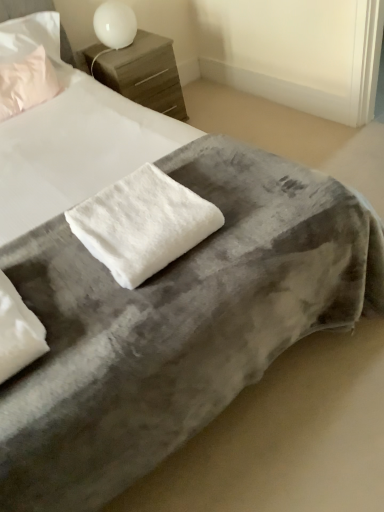
Where is `wooden nightstand at upper center`? Image resolution: width=384 pixels, height=512 pixels. wooden nightstand at upper center is located at coordinates (141, 72).

Describe the element at coordinates (17, 332) in the screenshot. Image resolution: width=384 pixels, height=512 pixels. I see `white fluffy pillow at lower left, which is counted as the 1th pillow, starting from the bottom` at that location.

Measure the distance between white fluffy towel at center and camera.

white fluffy towel at center and camera are 3.60 feet apart from each other.

Describe the element at coordinates (26, 83) in the screenshot. The width and height of the screenshot is (384, 512). I see `matte pink pillow at upper left, the 2th pillow from the front` at that location.

Describe the element at coordinates (115, 24) in the screenshot. I see `white glossy table lamp at upper center` at that location.

You are a GUI agent. You are given a task and a screenshot of the screen. Output one action in this format:
    pyautogui.click(x=<x>, y=<y>)
    Task: Click on the wooden nightstand at upper center
    This screenshot has height=512, width=384.
    Given the screenshot: What is the action you would take?
    pyautogui.click(x=141, y=72)

Does point (145, 98) come in front of point (96, 9)?

No, it is not.

Does wooden nightstand at upper center have a lesser width compared to white glossy table lamp at upper center?

In fact, wooden nightstand at upper center might be wider than white glossy table lamp at upper center.

From the picture: From a real-world perspective, is wooden nightstand at upper center physically below white glossy table lamp at upper center?

Yes, from a real-world perspective, wooden nightstand at upper center is under white glossy table lamp at upper center.

Is wooden nightstand at upper center to the left of white glossy table lamp at upper center from the viewer's perspective?

No.

Is matte pink pillow at upper left, the 2th pillow from the front, located outside white fluffy pillow at lower left, the 1th pillow when ordered from front to back?

Result: matte pink pillow at upper left, the 2th pillow from the front, lies outside white fluffy pillow at lower left, the 1th pillow when ordered from front to back,'s area.

From a real-world perspective, who is located lower, matte pink pillow at upper left, which is the 1th pillow in top-to-bottom order, or white fluffy pillow at lower left, the second pillow in the top-to-bottom sequence?

white fluffy pillow at lower left, the second pillow in the top-to-bottom sequence.

Which is more to the right, matte pink pillow at upper left, which is the 1th pillow in top-to-bottom order, or white fluffy pillow at lower left, the 1th pillow when ordered from front to back?

→ white fluffy pillow at lower left, the 1th pillow when ordered from front to back, is more to the right.

Which object is further away from the camera taking this photo, matte pink pillow at upper left, positioned as the second pillow in right-to-left order, or white fluffy pillow at lower left, the first pillow in the right-to-left sequence?

matte pink pillow at upper left, positioned as the second pillow in right-to-left order, is further from the camera.

Considering the relative positions of white glossy table lamp at upper center and wooden nightstand at upper center in the image provided, is white glossy table lamp at upper center in front of wooden nightstand at upper center?

Yes, white glossy table lamp at upper center is in front of wooden nightstand at upper center.

Is point (115, 22) closer or farther from the camera than point (153, 106)?

Clearly, point (115, 22) is closer to the camera than point (153, 106).

Is white glossy table lamp at upper center bigger or smaller than wooden nightstand at upper center?

Considering their sizes, white glossy table lamp at upper center takes up less space than wooden nightstand at upper center.

From a real-world perspective, relative to wooden nightstand at upper center, is white glossy table lamp at upper center vertically above or below?

From a real-world perspective, white glossy table lamp at upper center is physically above wooden nightstand at upper center.

Is white fluffy towel at center not within matte pink pillow at upper left, the 2th pillow from the front?

Yes, white fluffy towel at center is not within matte pink pillow at upper left, the 2th pillow from the front.

Image resolution: width=384 pixels, height=512 pixels. Find the location of `cloth that appears on the right of matte pink pillow at upper left, the first pillow positioned from the left`. cloth that appears on the right of matte pink pillow at upper left, the first pillow positioned from the left is located at coordinates (142, 224).

Is white fluffy towel at center far from matte pink pillow at upper left, marked as the second pillow in a bottom-to-top arrangement?

That's right, there is a large distance between white fluffy towel at center and matte pink pillow at upper left, marked as the second pillow in a bottom-to-top arrangement.

What's the angular difference between white fluffy towel at center and matte pink pillow at upper left, marked as the second pillow in a bottom-to-top arrangement,'s facing directions?

The facing directions of white fluffy towel at center and matte pink pillow at upper left, marked as the second pillow in a bottom-to-top arrangement, are 2.74 degrees apart.

Considering the sizes of objects white fluffy pillow at lower left, the second pillow in the top-to-bottom sequence, and white fluffy towel at center in the image provided, who is shorter, white fluffy pillow at lower left, the second pillow in the top-to-bottom sequence, or white fluffy towel at center?

Standing shorter between the two is white fluffy towel at center.

Which object is wider, white fluffy pillow at lower left, the first pillow in the right-to-left sequence, or white fluffy towel at center?

white fluffy pillow at lower left, the first pillow in the right-to-left sequence.

Which is closer, (19, 331) or (216, 226)?

Point (19, 331) is closer to the camera than point (216, 226).

Looking at this image, is matte pink pillow at upper left, which is the 1th pillow in top-to-bottom order, taller or shorter than wooden nightstand at upper center?

In the image, matte pink pillow at upper left, which is the 1th pillow in top-to-bottom order, appears to be shorter than wooden nightstand at upper center.

How many degrees apart are the facing directions of matte pink pillow at upper left, positioned as the second pillow in right-to-left order, and wooden nightstand at upper center?

The facing directions of matte pink pillow at upper left, positioned as the second pillow in right-to-left order, and wooden nightstand at upper center are 3.21 degrees apart.

Is matte pink pillow at upper left, the first pillow positioned from the left, wider or thinner than wooden nightstand at upper center?

Considering their sizes, matte pink pillow at upper left, the first pillow positioned from the left, looks slimmer than wooden nightstand at upper center.

Which of these two, wooden nightstand at upper center or matte pink pillow at upper left, the 2th pillow from the front, is thinner?

Thinner between the two is matte pink pillow at upper left, the 2th pillow from the front.

Would you consider wooden nightstand at upper center to be distant from matte pink pillow at upper left, the first pillow positioned from the left?

wooden nightstand at upper center is actually quite close to matte pink pillow at upper left, the first pillow positioned from the left.

What are the coordinates of `nightstand that is under the matte pink pillow at upper left, the 2th pillow from the front (from a real-world perspective)` in the screenshot? It's located at (141, 72).

Which of these two, wooden nightstand at upper center or matte pink pillow at upper left, positioned as the second pillow in right-to-left order, is bigger?

Bigger between the two is wooden nightstand at upper center.

Locate an element on the screen. The image size is (384, 512). nightstand below the white glossy table lamp at upper center (from the image's perspective) is located at coordinates (141, 72).

Find the location of a particular element. Image resolution: width=384 pixels, height=512 pixels. pillow that is above the white fluffy pillow at lower left, which is counted as the 1th pillow, starting from the bottom (from the image's perspective) is located at coordinates (26, 83).

Based on their spatial positions, is matte pink pillow at upper left, which appears as the 1th pillow when viewed from the back, or white fluffy pillow at lower left, which is counted as the 1th pillow, starting from the bottom, closer to wooden nightstand at upper center?

matte pink pillow at upper left, which appears as the 1th pillow when viewed from the back, is positioned closer to the anchor wooden nightstand at upper center.

Estimate the real-world distances between objects in this image. Which object is closer to wooden nightstand at upper center, matte pink pillow at upper left, which is the 1th pillow in top-to-bottom order, or white glossy table lamp at upper center?

white glossy table lamp at upper center lies closer to wooden nightstand at upper center than the other object.

When comparing their distances from wooden nightstand at upper center, does white glossy table lamp at upper center or matte pink pillow at upper left, which appears as the 1th pillow when viewed from the back, seem closer?

white glossy table lamp at upper center lies closer to wooden nightstand at upper center than the other object.

Estimate the real-world distances between objects in this image. Which object is closer to white fluffy pillow at lower left, which is counted as the 1th pillow, starting from the bottom, wooden nightstand at upper center or matte pink pillow at upper left, the first pillow positioned from the left?

Among the two, matte pink pillow at upper left, the first pillow positioned from the left, is located nearer to white fluffy pillow at lower left, which is counted as the 1th pillow, starting from the bottom.

Estimate the real-world distances between objects in this image. Which object is further from matte pink pillow at upper left, the first pillow positioned from the left, white fluffy pillow at lower left, which ranks as the second pillow in left-to-right order, or white fluffy towel at center?

white fluffy pillow at lower left, which ranks as the second pillow in left-to-right order, lies further to matte pink pillow at upper left, the first pillow positioned from the left, than the other object.

Looking at the image, which one is located closer to white fluffy pillow at lower left, which is counted as the 1th pillow, starting from the bottom, white fluffy towel at center or white glossy table lamp at upper center?

white fluffy towel at center is closer to white fluffy pillow at lower left, which is counted as the 1th pillow, starting from the bottom.

Estimate the real-world distances between objects in this image. Which object is further from white fluffy pillow at lower left, the 1th pillow when ordered from front to back, white glossy table lamp at upper center or white fluffy towel at center?

Based on the image, white glossy table lamp at upper center appears to be further to white fluffy pillow at lower left, the 1th pillow when ordered from front to back.

Looking at the image, which one is located further to matte pink pillow at upper left, the 2th pillow from the front, white fluffy towel at center or white fluffy pillow at lower left, the first pillow in the right-to-left sequence?

white fluffy pillow at lower left, the first pillow in the right-to-left sequence, is positioned further to the anchor matte pink pillow at upper left, the 2th pillow from the front.

Find the location of a particular element. The height and width of the screenshot is (512, 384). pillow between white glossy table lamp at upper center and white fluffy pillow at lower left, the second pillow in the top-to-bottom sequence, in the up-down direction is located at coordinates (26, 83).

Identify the location of pillow positioned between white fluffy towel at center and wooden nightstand at upper center from near to far. pyautogui.click(x=26, y=83).

The width and height of the screenshot is (384, 512). Find the location of `cloth positioned between white fluffy pillow at lower left, which appears as the 2th pillow when viewed from the back, and wooden nightstand at upper center from near to far`. cloth positioned between white fluffy pillow at lower left, which appears as the 2th pillow when viewed from the back, and wooden nightstand at upper center from near to far is located at coordinates (142, 224).

Identify the location of pillow between white glossy table lamp at upper center and white fluffy towel at center vertically. (26, 83).